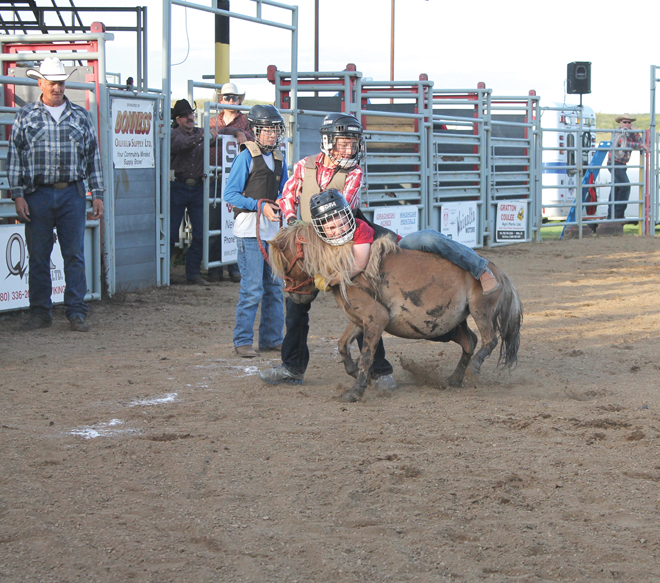
At what (x,y) coordinates should I click in order to perform the action: click on speaker. Please return your answer as a coordinate pair (x, y). This screenshot has width=660, height=583. Looking at the image, I should click on (578, 73).